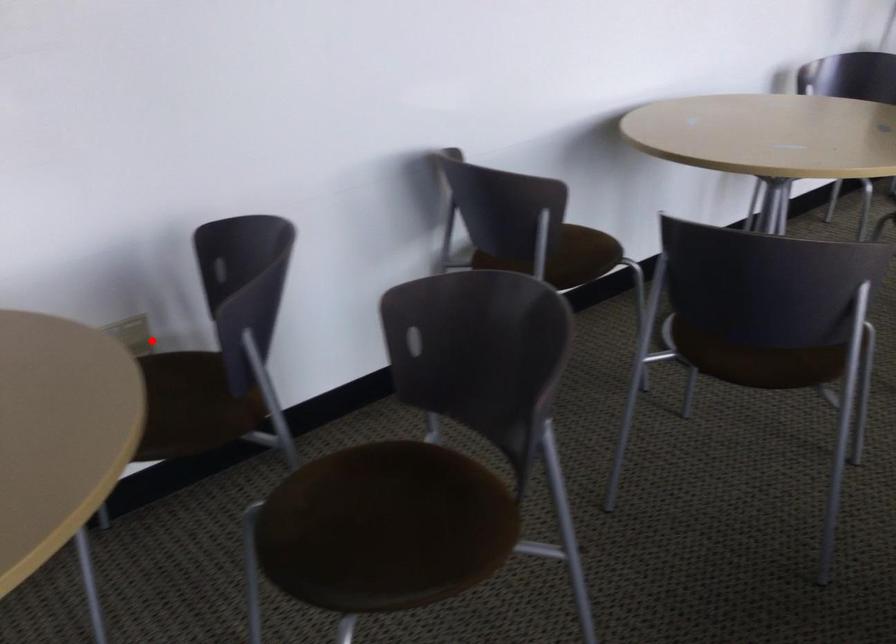
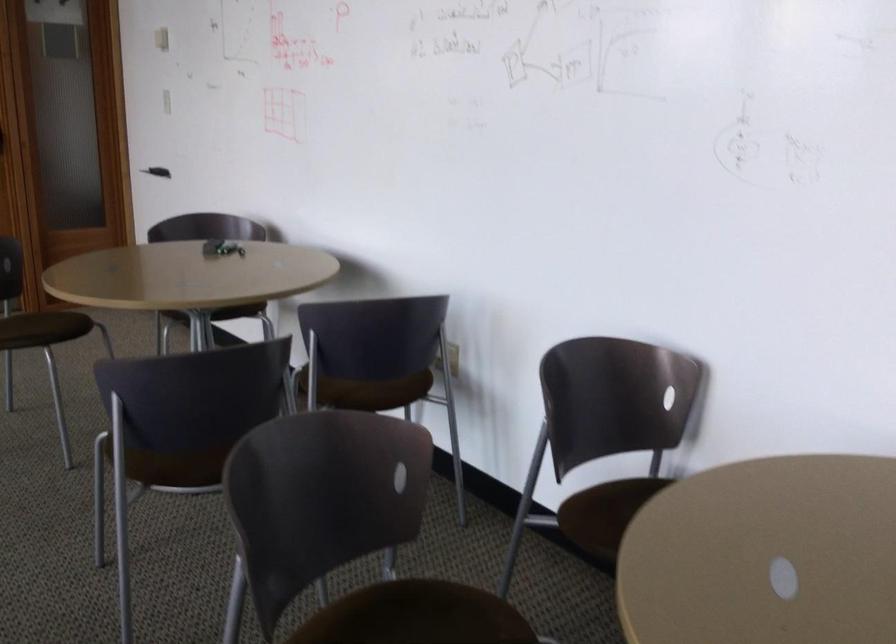
Question: I am providing you with two images of the same scene from different viewpoints. A red point is shown in image1. For the corresponding object point in image2, is it positioned nearer or farther from the camera?

Choices:
 (A) Nearer
 (B) Farther

Answer: (B)